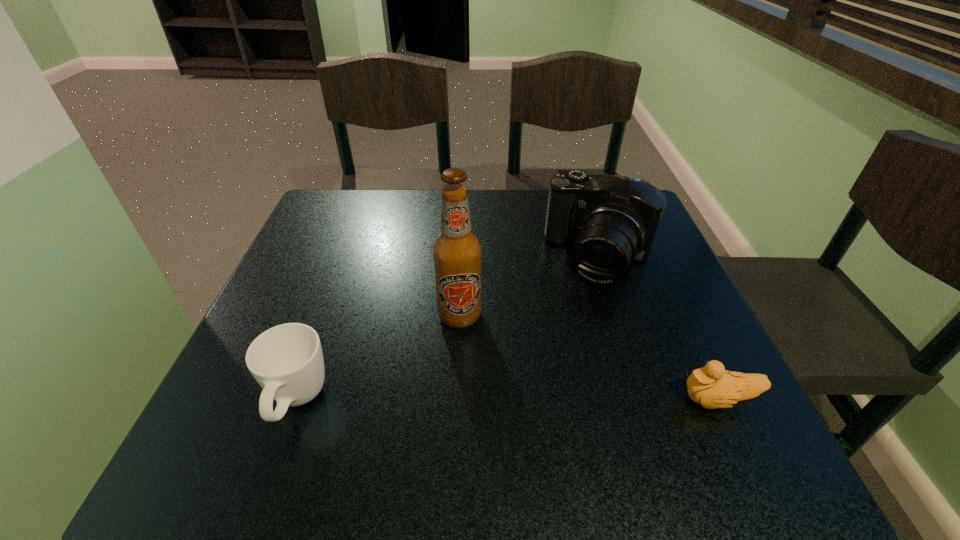
Locate an element on the screen. The height and width of the screenshot is (540, 960). object that is the nearest to the third nearest object is located at coordinates point(613,219).

Select which object appears as the third closest to the beer bottle. Please provide its 2D coordinates. Your answer should be formatted as a tuple, i.e. [(x, y)], where the tuple contains the x and y coordinates of a point satisfying the conditions above.

[(712, 386)]

Find the location of `vacant space that satisfies the following two spatial constraints: 1. on the front side of the second object from left to right; 2. on the face of the duckling`. vacant space that satisfies the following two spatial constraints: 1. on the front side of the second object from left to right; 2. on the face of the duckling is located at coordinates (456, 400).

The height and width of the screenshot is (540, 960). In order to click on free spot that satisfies the following two spatial constraints: 1. on the front side of the second tallest object; 2. on the face of the duckling in this screenshot , I will do `click(647, 400)`.